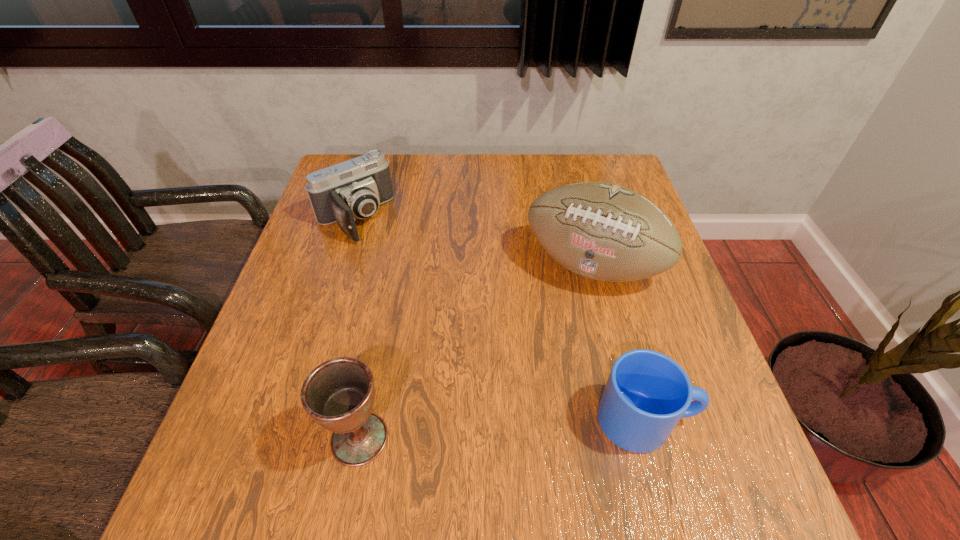
Where is `vacant space at the far edge of the desktop`? vacant space at the far edge of the desktop is located at coordinates (404, 154).

The image size is (960, 540). In the image, there is a desktop. Identify the location of blank space at the left edge. (320, 241).

Where is `vacant space at the right edge of the desktop`? vacant space at the right edge of the desktop is located at coordinates (651, 319).

The width and height of the screenshot is (960, 540). In the image, there is a desktop. What are the coordinates of `vacant space at the near left corner` in the screenshot? It's located at (247, 423).

This screenshot has width=960, height=540. I want to click on vacant space at the far right corner of the desktop, so click(611, 164).

In the image, there is a desktop. At what (x,y) coordinates should I click in order to perform the action: click on free space at the near right corner. Please return your answer as a coordinate pair (x, y). Image resolution: width=960 pixels, height=540 pixels. Looking at the image, I should click on (682, 424).

Where is `vacant area that lies between the camera and the shortest object`? This screenshot has height=540, width=960. vacant area that lies between the camera and the shortest object is located at coordinates (500, 319).

Where is `free spot between the football (American) and the camera`? The image size is (960, 540). free spot between the football (American) and the camera is located at coordinates (473, 242).

At what (x,y) coordinates should I click in order to perform the action: click on free spot between the chalice and the camera. Please return your answer as a coordinate pair (x, y). The width and height of the screenshot is (960, 540). Looking at the image, I should click on (357, 328).

I want to click on free space between the football (American) and the camera, so click(473, 242).